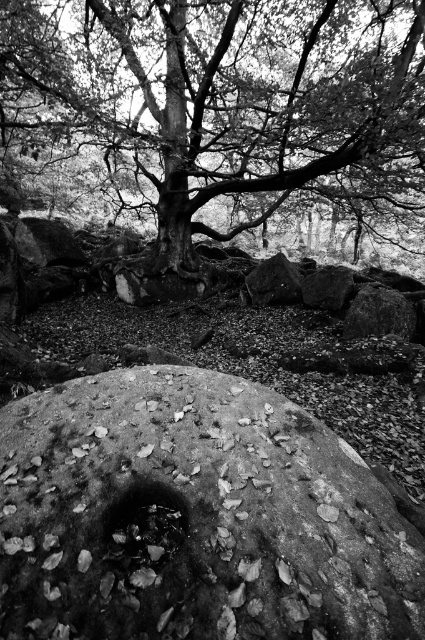
You are a geologist examining the scene. You need to locate the rough textured rock at center and the smooth bark tree at center. According to the spatial relationship between them, which object is positioned to the right of the other?

The rough textured rock at center is positioned to the right of the smooth bark tree at center.

You are standing in the scene looking at the two points marked in the image. Which point, point (x=234, y=77) or point (x=163, y=189), is closer to you?

Point (x=234, y=77) is closer to you than point (x=163, y=189).

You are standing at the center of the image and see a point marked at coordinates point [195,516]. What object is located at that point?

The point [195,516] marks a rough textured rock at center.